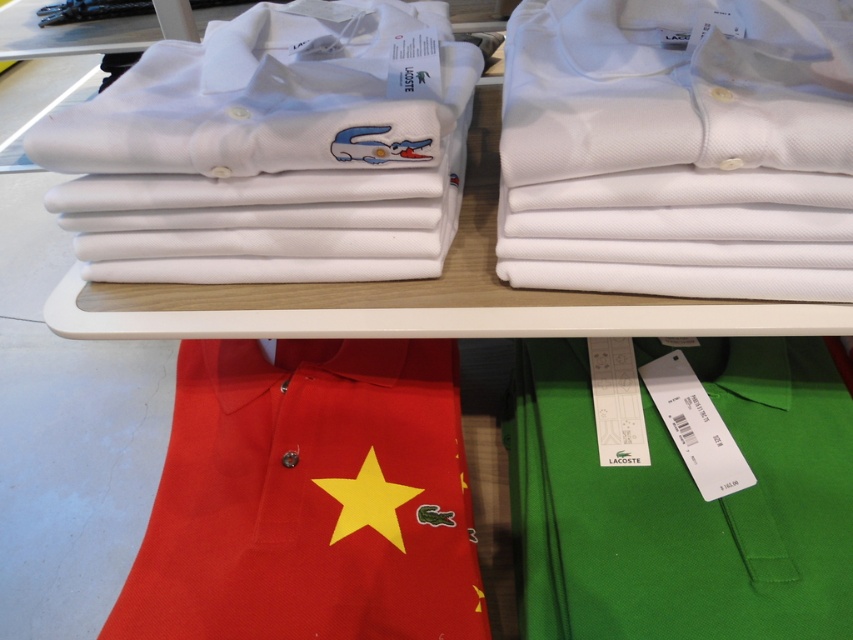
Consider the image. Does white cotton shirt at upper center appear over green cotton polo shirt at lower right?

Yes.

Image resolution: width=853 pixels, height=640 pixels. Describe the element at coordinates (677, 147) in the screenshot. I see `white cotton shirt at upper center` at that location.

Is point (570, 80) positioned behind point (769, 426)?

No, it is in front of (769, 426).

At what (x,y) coordinates should I click in order to perform the action: click on white cotton shirt at upper center. Please return your answer as a coordinate pair (x, y). The image size is (853, 640). Looking at the image, I should click on (677, 147).

Can you confirm if white cotton shirt at upper center is positioned to the right of white cotton shirt at upper left?

Correct, you'll find white cotton shirt at upper center to the right of white cotton shirt at upper left.

Does white cotton shirt at upper center have a larger size compared to white cotton shirt at upper left?

No, white cotton shirt at upper center is not bigger than white cotton shirt at upper left.

The width and height of the screenshot is (853, 640). I want to click on white cotton shirt at upper center, so click(677, 147).

Does white cotton shirt at upper left appear over red cotton polo shirt at lower left?

Correct, white cotton shirt at upper left is located above red cotton polo shirt at lower left.

Can you confirm if white cotton shirt at upper left is positioned below red cotton polo shirt at lower left?

No, white cotton shirt at upper left is not below red cotton polo shirt at lower left.

Between point (200, 173) and point (172, 620), which one is positioned in front?

Point (200, 173) is in front.

Locate an element on the screen. white cotton shirt at upper left is located at coordinates (271, 148).